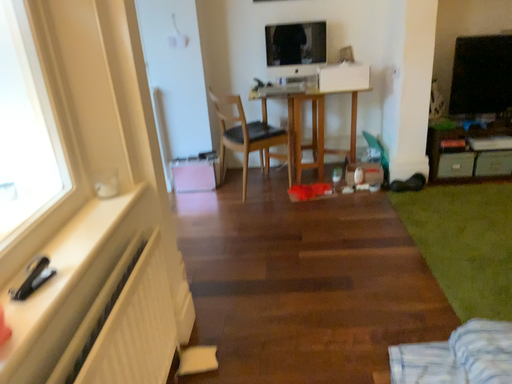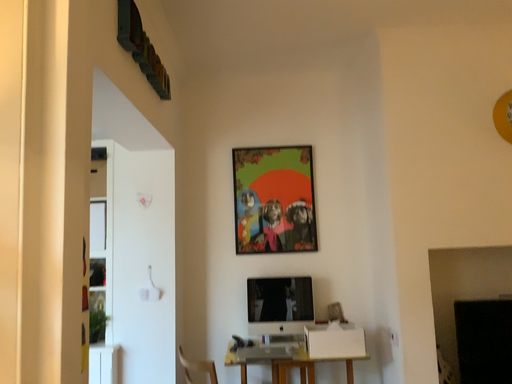
Question: How did the camera likely rotate when shooting the video?

Choices:
 (A) rotated upward
 (B) rotated downward

Answer: (A)